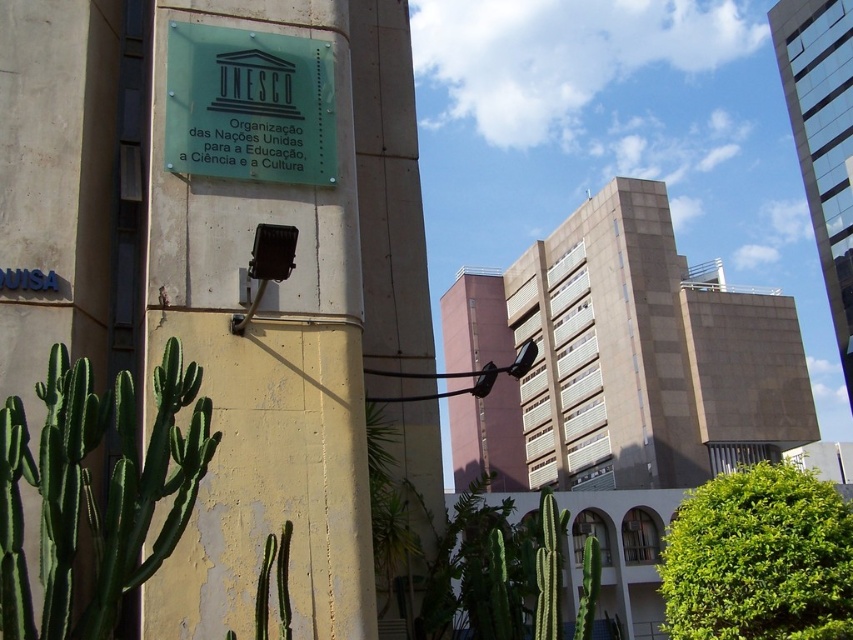
Question: From the image, what is the correct spatial relationship of green spiky cactus at lower left in relation to transparent glass sign at upper center?

Choices:
 (A) below
 (B) above

Answer: (A)

Question: Among these points, which one is farthest from the camera?

Choices:
 (A) (273, 125)
 (B) (65, 544)

Answer: (A)

Question: Can you confirm if green spiky cactus at lower left is smaller than transparent glass sign at upper center?

Choices:
 (A) no
 (B) yes

Answer: (A)

Question: Observing the image, what is the correct spatial positioning of green spiky cactus at lower left in reference to transparent glass sign at upper center?

Choices:
 (A) below
 (B) above

Answer: (A)

Question: Which point is closer to the camera?

Choices:
 (A) transparent glass sign at upper center
 (B) green spiky cactus at lower left

Answer: (B)

Question: Which point is closer to the camera?

Choices:
 (A) (190, 36)
 (B) (102, 433)

Answer: (B)